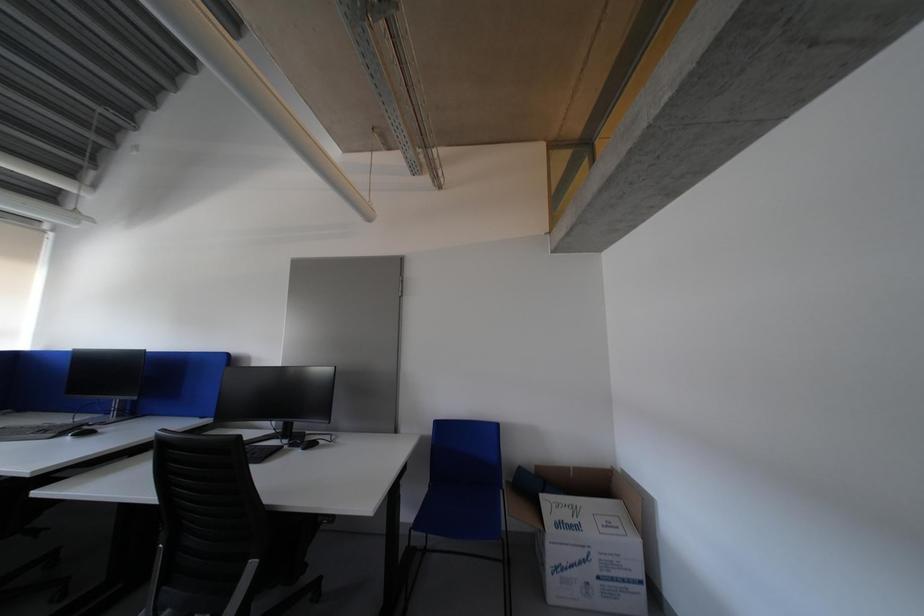
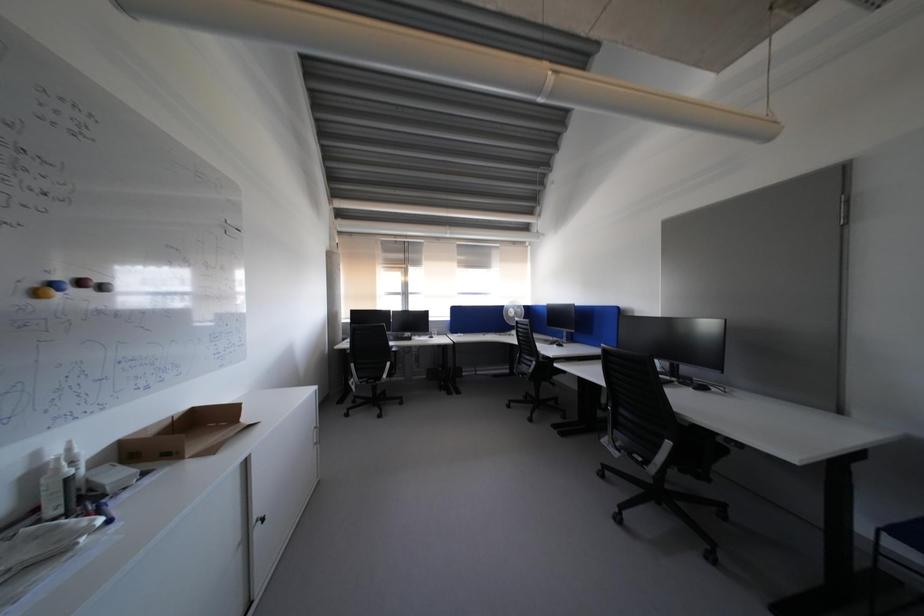
Question: The camera is either moving clockwise (left) or counter-clockwise (right) around the object. The first image is from the beginning of the video and the second image is from the end. Is the camera moving left or right when shooting the video?

Choices:
 (A) Left
 (B) Right

Answer: (B)